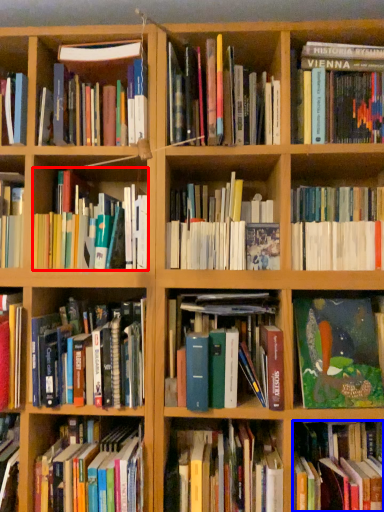
Question: Which point is further to the camera, book (highlighted by a red box) or book (highlighted by a blue box)?

Choices:
 (A) book
 (B) book

Answer: (A)